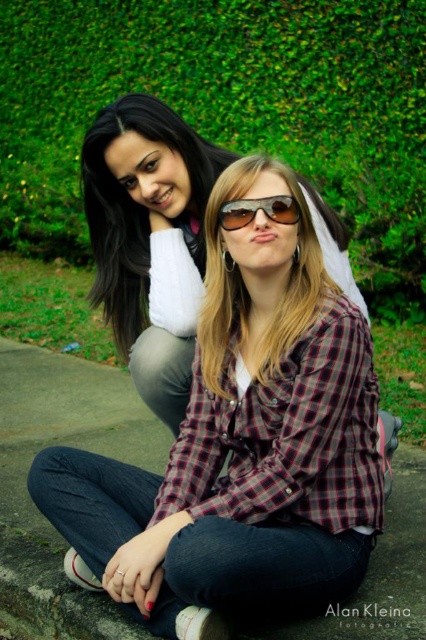
You are a photographer trying to capture a candid shot of the sunglasses at center without including the green leafy hedge at upper center in the frame. Based on their positions, is this possible?

The green leafy hedge at upper center is located above the sunglasses at center, so it would block the upper part of the frame. To avoid including the hedge, the photographer could lower the camera angle or position themselves lower to exclude the hedge from the shot.

You are a photographer trying to capture a photo of the plaid shirt at center. The green leafy hedge at upper center might block the view. Can you confirm if the hedge is wider than the plaid shirt?

The green leafy hedge at upper center might be wider than plaid shirt at center according to the description, so there is a possibility that the hedge could block the view of the plaid shirt at center.

You are standing in a park and see the green leafy hedge at upper center and the plaid shirt at center. Which object is positioned to the left when viewed from your perspective?

The green leafy hedge at upper center is positioned to the left of the plaid shirt at center.